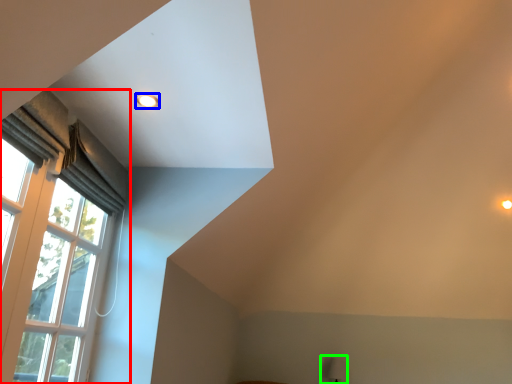
Question: Which object is positioned farthest from window (highlighted by a red box)? Select from lighting (highlighted by a blue box) and table lamp (highlighted by a green box).

Choices:
 (A) lighting
 (B) table lamp

Answer: (B)